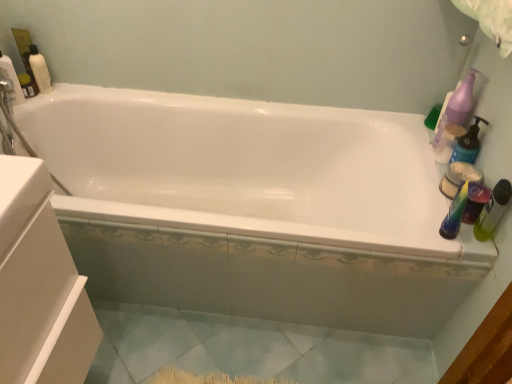
Question: Does matte white bottle at upper left, the 1th cleaning product viewed from the top, have a greater height compared to purple plastic pump bottle at upper right, the 1th cleaning product viewed from the right?

Choices:
 (A) yes
 (B) no

Answer: (B)

Question: Is matte white bottle at upper left, the 1th cleaning product viewed from the top, closer to the viewer compared to purple plastic pump bottle at upper right, which is counted as the third cleaning product, starting from the left?

Choices:
 (A) no
 (B) yes

Answer: (A)

Question: Considering the relative sizes of matte white bottle at upper left, arranged as the 3th cleaning product when viewed from the right, and purple plastic pump bottle at upper right, placed as the 2th cleaning product when sorted from bottom to top, in the image provided, is matte white bottle at upper left, arranged as the 3th cleaning product when viewed from the right, bigger than purple plastic pump bottle at upper right, placed as the 2th cleaning product when sorted from bottom to top,?

Choices:
 (A) yes
 (B) no

Answer: (B)

Question: Is purple plastic pump bottle at upper right, which is counted as the third cleaning product, starting from the left, a part of matte white bottle at upper left, the third cleaning product in the bottom-to-top sequence?

Choices:
 (A) yes
 (B) no

Answer: (B)

Question: Does matte white bottle at upper left, the third cleaning product in the bottom-to-top sequence, lie behind purple plastic pump bottle at upper right, which is counted as the third cleaning product, starting from the left?

Choices:
 (A) yes
 (B) no

Answer: (A)

Question: Considering their positions, is matte purple pump bottle at right, placed as the 2th cleaning product when sorted from right to left, located in front of or behind light blue ceramic tile at lower center?

Choices:
 (A) behind
 (B) front

Answer: (B)

Question: Visually, is matte purple pump bottle at right, acting as the 2th cleaning product starting from the left, positioned to the left or to the right of light blue ceramic tile at lower center?

Choices:
 (A) left
 (B) right

Answer: (B)

Question: Considering the positions of point (456, 158) and point (385, 350), is point (456, 158) closer or farther from the camera than point (385, 350)?

Choices:
 (A) closer
 (B) farther

Answer: (A)

Question: Considering the positions of matte purple pump bottle at right, placed as the 2th cleaning product when sorted from right to left, and light blue ceramic tile at lower center in the image, is matte purple pump bottle at right, placed as the 2th cleaning product when sorted from right to left, wider or thinner than light blue ceramic tile at lower center?

Choices:
 (A) wide
 (B) thin

Answer: (B)

Question: From the image's perspective, is white glossy bathtub at center above or below purple plastic pump bottle at upper right, placed as the 2th cleaning product when sorted from bottom to top?

Choices:
 (A) below
 (B) above

Answer: (A)

Question: Based on their positions, is white glossy bathtub at center located to the left or right of purple plastic pump bottle at upper right, acting as the second cleaning product starting from the top?

Choices:
 (A) left
 (B) right

Answer: (A)

Question: Is point (164, 107) positioned closer to the camera than point (461, 110)?

Choices:
 (A) farther
 (B) closer

Answer: (A)

Question: Is white glossy bathtub at center wider or thinner than purple plastic pump bottle at upper right, placed as the 2th cleaning product when sorted from bottom to top?

Choices:
 (A) thin
 (B) wide

Answer: (B)

Question: Is white glossy bathtub at center inside the boundaries of matte white bottle at upper left, which is the first cleaning product in left-to-right order, or outside?

Choices:
 (A) inside
 (B) outside

Answer: (B)

Question: From the image's perspective, is white glossy bathtub at center located above or below matte white bottle at upper left, the 1th cleaning product viewed from the top?

Choices:
 (A) below
 (B) above

Answer: (A)